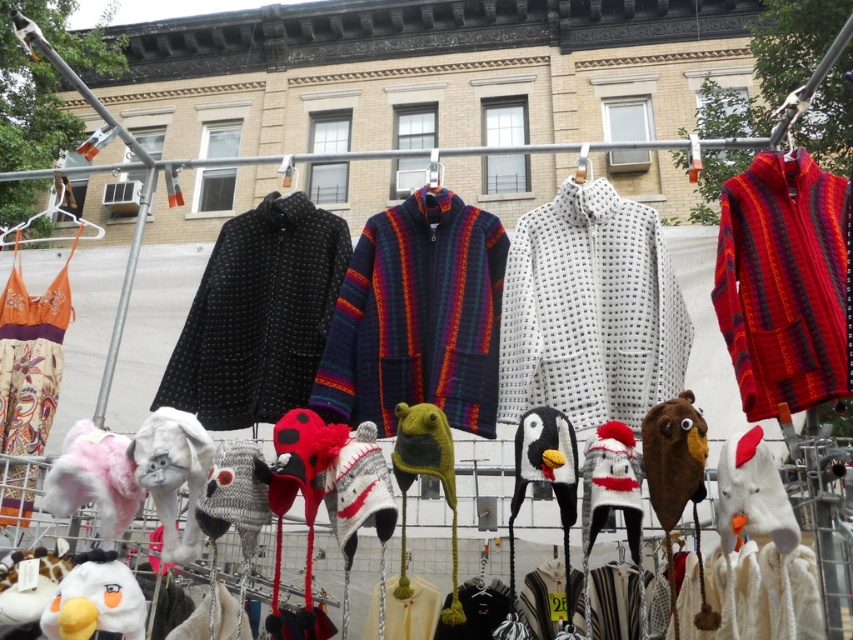
Between black dotted fabric coat at center and white plush dog at lower left, which one is positioned lower?

white plush dog at lower left is lower down.

Does black dotted fabric coat at center appear on the left side of white plush dog at lower left?

Incorrect, black dotted fabric coat at center is not on the left side of white plush dog at lower left.

The height and width of the screenshot is (640, 853). Identify the location of black dotted fabric coat at center. pos(258,316).

This screenshot has width=853, height=640. What are the coordinates of `black dotted fabric coat at center` in the screenshot? It's located at coord(258,316).

Is black dotted fabric coat at center bigger than white plush toy at lower left?

Yes, black dotted fabric coat at center is bigger than white plush toy at lower left.

Based on the photo, is black dotted fabric coat at center positioned behind white plush toy at lower left?

Yes, black dotted fabric coat at center is further from the viewer.

Where is `black dotted fabric coat at center`? The height and width of the screenshot is (640, 853). black dotted fabric coat at center is located at coordinates (258, 316).

Where is `black dotted fabric coat at center`? The height and width of the screenshot is (640, 853). black dotted fabric coat at center is located at coordinates (258, 316).

Who is more forward, (683, 444) or (561, 444)?

Positioned in front is point (683, 444).

Can you confirm if brown fuzzy bear at center is thinner than knitted wool penguin at center?

Indeed, brown fuzzy bear at center has a lesser width compared to knitted wool penguin at center.

Which is behind, point (685, 497) or point (544, 426)?

The point (544, 426) is more distant.

At what (x,y) coordinates should I click in order to perform the action: click on brown fuzzy bear at center. Please return your answer as a coordinate pair (x, y). The image size is (853, 640). Looking at the image, I should click on (672, 456).